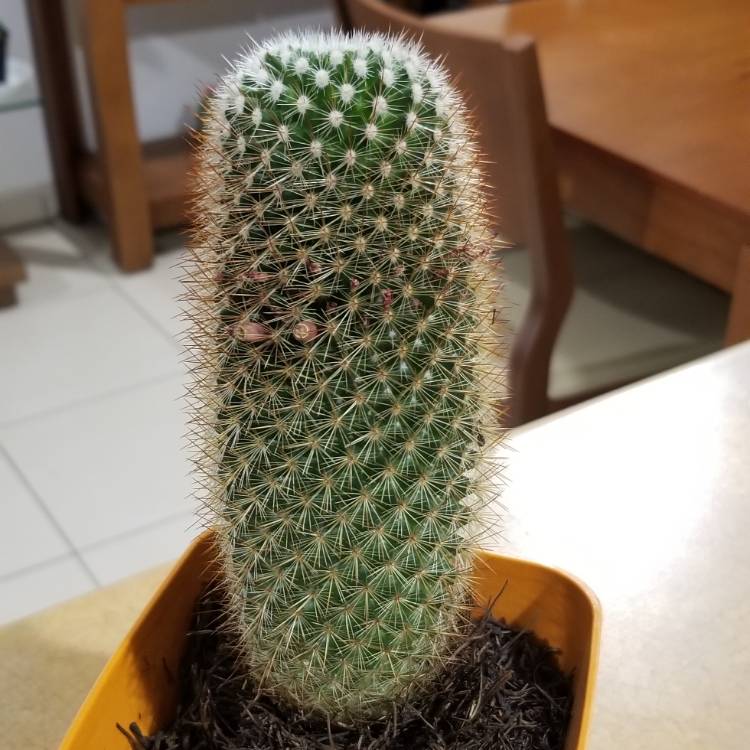
Find the location of `countertop`. countertop is located at coordinates (643, 488).